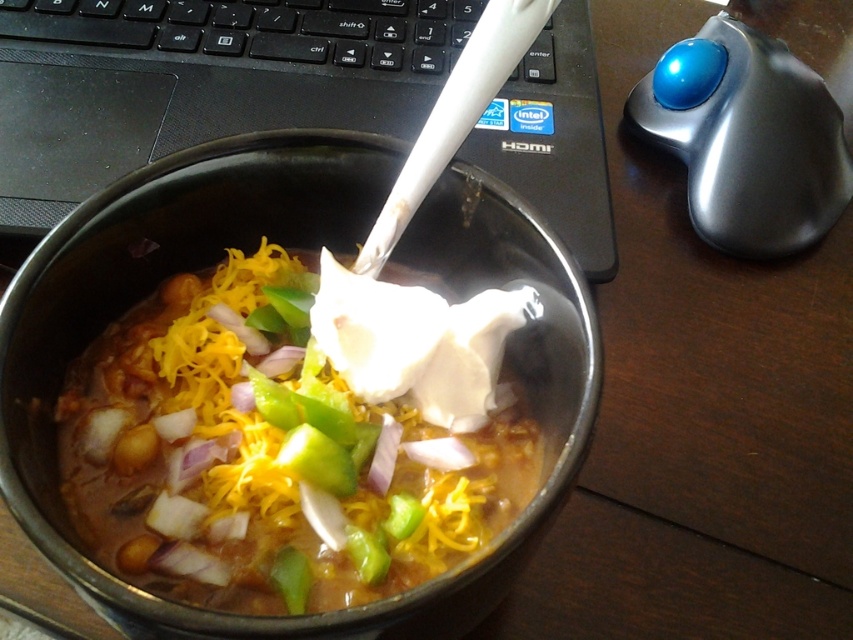
From the picture: You are a graphic designer working at your desk and need to adjust the cursor position. You have a metallic trackball at upper right located at point (746, 138). Can you reach it without moving your chair?

The metallic trackball at upper right is located at point (746, 138), which is within comfortable reach for most people while sitting at a desk, so yes, you can likely reach it without moving your chair.

You are organizing items on a desk and need to place both the smooth white cream at center and the metallic trackball at upper right. If you want to arrange them so that the wider item is on the left side of the narrower one, which item should be placed where?

The smooth white cream at center is wider than the metallic trackball at upper right, so you should place the smooth white cream at center on the left and the metallic trackball at upper right on the right.

You are a photographer trying to capture a closeup of the chili bowl. The black plastic laptop at upper left is in the frame. If you move the camera 5 inches closer to the chili bowl, will the laptop still be visible in the photo?

The black plastic laptop at upper left is 17.86 inches away from camera. Moving the camera 5 inches closer would reduce the distance to 12.86 inches. Since the laptop is still within the camera frame, it would remain visible.